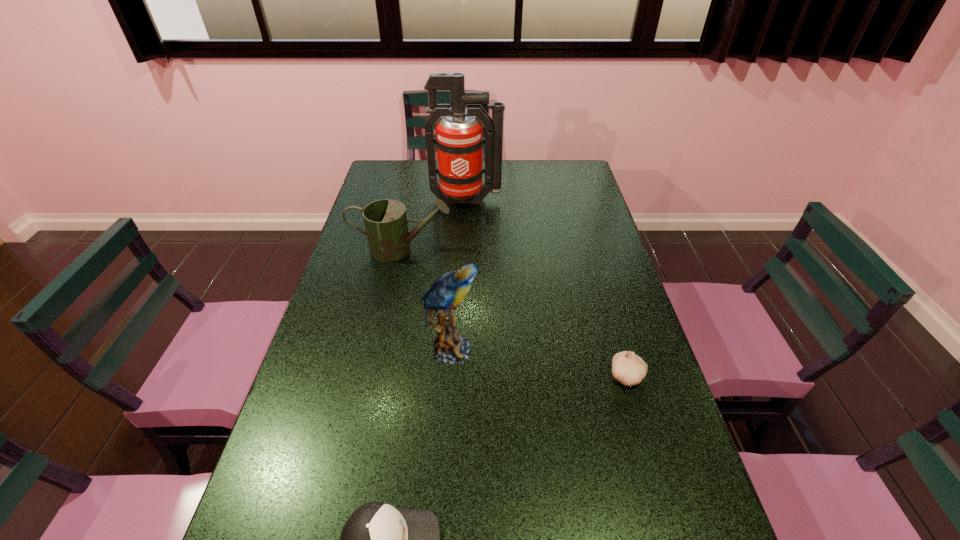
Where is `fire extinguisher`? The image size is (960, 540). fire extinguisher is located at coordinates (459, 138).

I want to click on the tallest object, so click(x=459, y=138).

The image size is (960, 540). In order to click on parrot in this screenshot , I will do `click(446, 293)`.

Image resolution: width=960 pixels, height=540 pixels. Identify the location of the fourth nearest object. (385, 220).

This screenshot has width=960, height=540. In order to click on the third shortest object in this screenshot , I will do `click(385, 220)`.

You are a GUI agent. You are given a task and a screenshot of the screen. Output one action in this format:
    pyautogui.click(x=<x>, y=<y>)
    Task: Click on the garlic
    This screenshot has width=960, height=540.
    Given the screenshot: What is the action you would take?
    pyautogui.click(x=628, y=368)

The width and height of the screenshot is (960, 540). In order to click on free space located 0.140m on the front label side of the tallest object in this screenshot , I will do `click(466, 235)`.

Locate an element on the screen. The image size is (960, 540). blank space located 0.260m on the face of the second tallest object is located at coordinates (578, 349).

Locate an element on the screen. vacant space located with the spout on the third shortest object is located at coordinates (513, 249).

You are a GUI agent. You are given a task and a screenshot of the screen. Output one action in this format:
    pyautogui.click(x=<x>, y=<y>)
    Task: Click on the free space located on the back of the rightmost object
    The height and width of the screenshot is (540, 960).
    Given the screenshot: What is the action you would take?
    pyautogui.click(x=606, y=302)